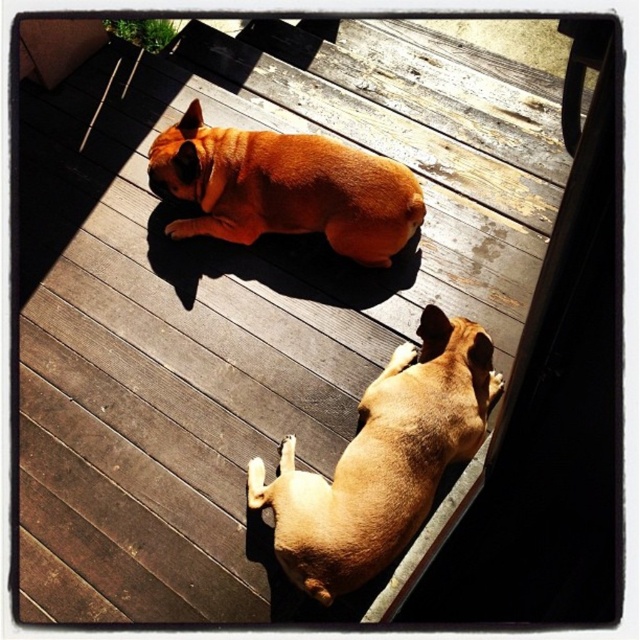
Consider the image. Who is more forward, [436,376] or [232,211]?

Point [436,376] is in front.

Describe the element at coordinates (381, 460) in the screenshot. The height and width of the screenshot is (640, 640). I see `light brown fur at lower right` at that location.

You are a GUI agent. You are given a task and a screenshot of the screen. Output one action in this format:
    pyautogui.click(x=<x>, y=<y>)
    Task: Click on the light brown fur at lower right
    Image resolution: width=640 pixels, height=640 pixels.
    Given the screenshot: What is the action you would take?
    pyautogui.click(x=381, y=460)